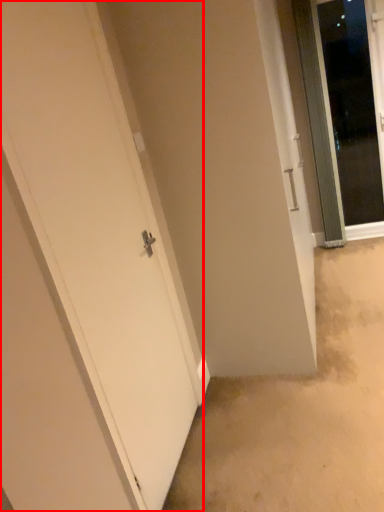
Question: From the image's perspective, what is the correct spatial positioning of door (annotated by the red box) in reference to door?

Choices:
 (A) below
 (B) above

Answer: (A)